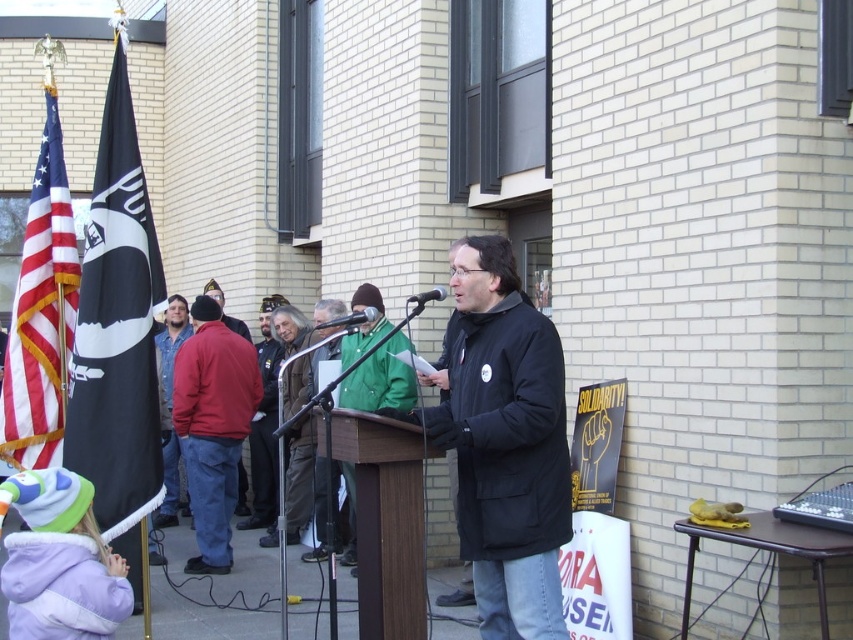
You are a photographer at the event. You need to capture a photo where the red cotton jacket at center is clearly visible above the metallic silver microphone at center. Is this possible based on their positions?

The red cotton jacket at center is much taller than the metallic silver microphone at center, so yes, it can be clearly visible above the microphone in the photo.

You are a photographer at the event and want to capture a photo of the black matte jacket at center and the american flag at left. Based on their positions, which object should you focus on first if you want to include both in the frame without moving the camera?

The black matte jacket at center is positioned on the right side of the american flag at left, so you should focus on the american flag at left first to ensure both are in the frame.